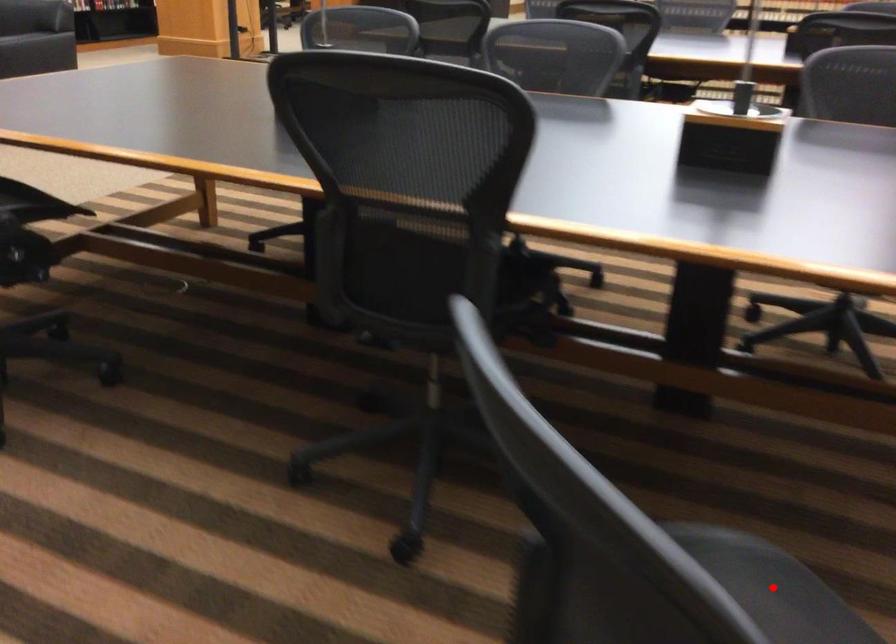
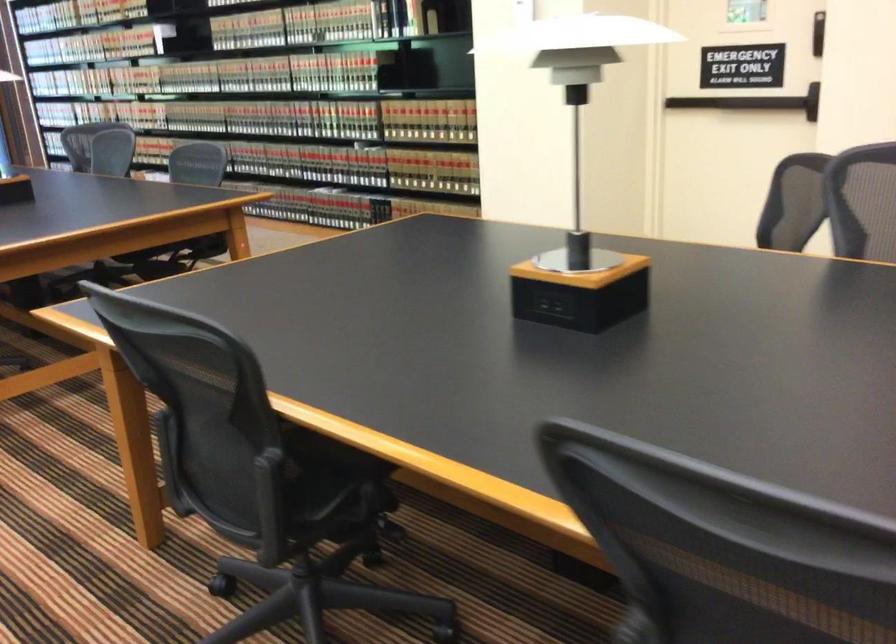
Question: I am providing you with two images of the same scene from different viewpoints. A red point is marked on the first image. Can you still see the location of the red point in image 2?

Choices:
 (A) Yes
 (B) No

Answer: (B)